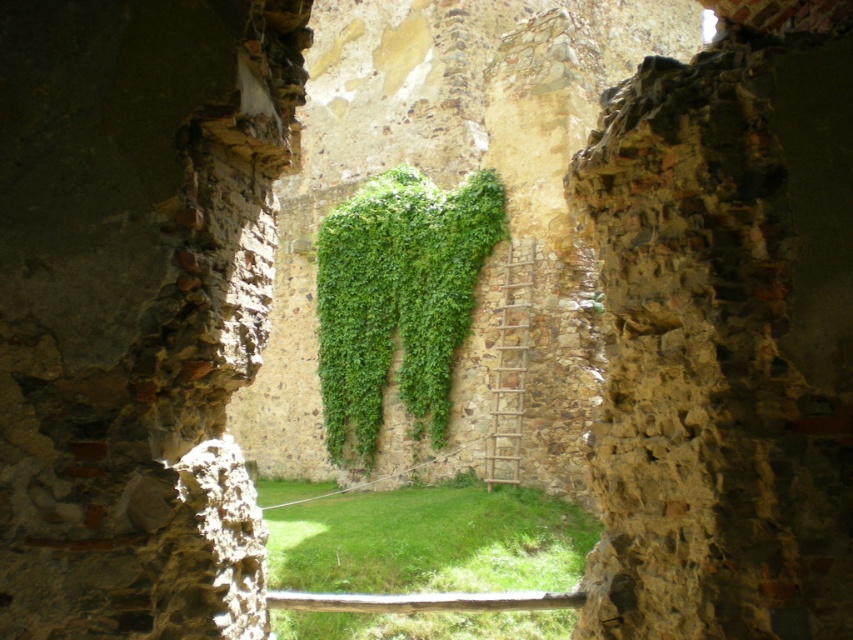
Question: Is green grass at center positioned at the back of green leafy ivy at center?

Choices:
 (A) yes
 (B) no

Answer: (B)

Question: Among these objects, which one is farthest from the camera?

Choices:
 (A) green grass at center
 (B) green leafy ivy at center

Answer: (B)

Question: Does green grass at center appear on the right side of green leafy ivy at center?

Choices:
 (A) no
 (B) yes

Answer: (A)

Question: Observing the image, what is the correct spatial positioning of green grass at center in reference to green leafy ivy at center?

Choices:
 (A) left
 (B) right

Answer: (A)

Question: Among these points, which one is farthest from the camera?

Choices:
 (A) (393, 202)
 (B) (347, 564)

Answer: (A)